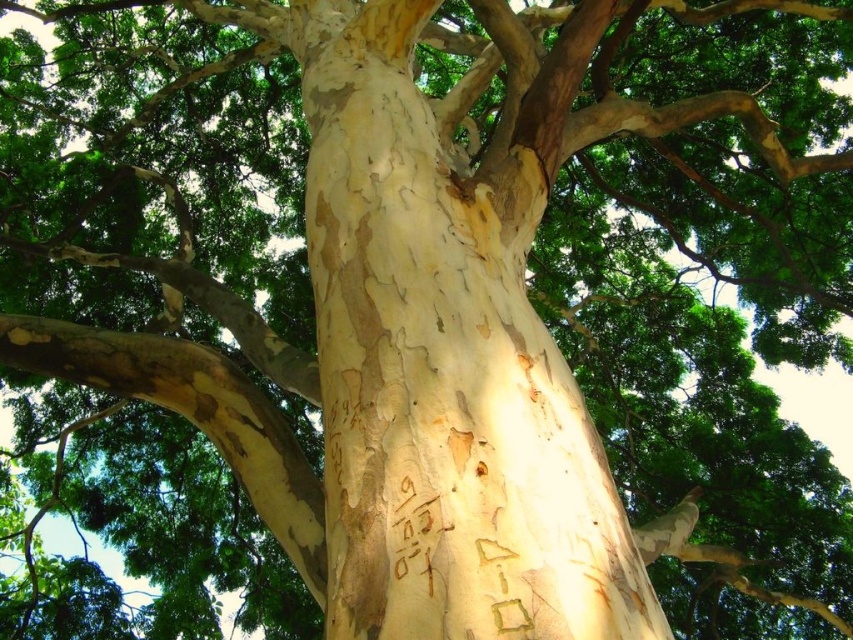
You are an arborist examining the tree trunk. You notice two distinct bark sections at the center. Which of the two, the white textured bark at center or the brown rough bark at center, extends higher up the trunk?

The white textured bark at center extends higher up the trunk than the brown rough bark at center because it has a greater height compared to it.

In the scene shown: You are standing in front of a tree trunk and want to touch the white textured bark at center. Based on the image, where should you aim your hand to reach it?

The white textured bark at center is located at the 2D coordinates point (x=450, y=355), so you should aim your hand towards that specific point on the tree trunk to reach it.

In the scene shown: You are a painter standing 30 inches away from the tree trunk. You want to paint both the white textured bark at center and the brown rough bark at center. Can you reach both areas with your 18 inch long paintbrush?

The distance between the white textured bark at center and brown rough bark at center is 22.30 inches. Since your paintbrush is only 18 inches long, you cannot reach both areas simultaneously as the distance exceeds the brush length.